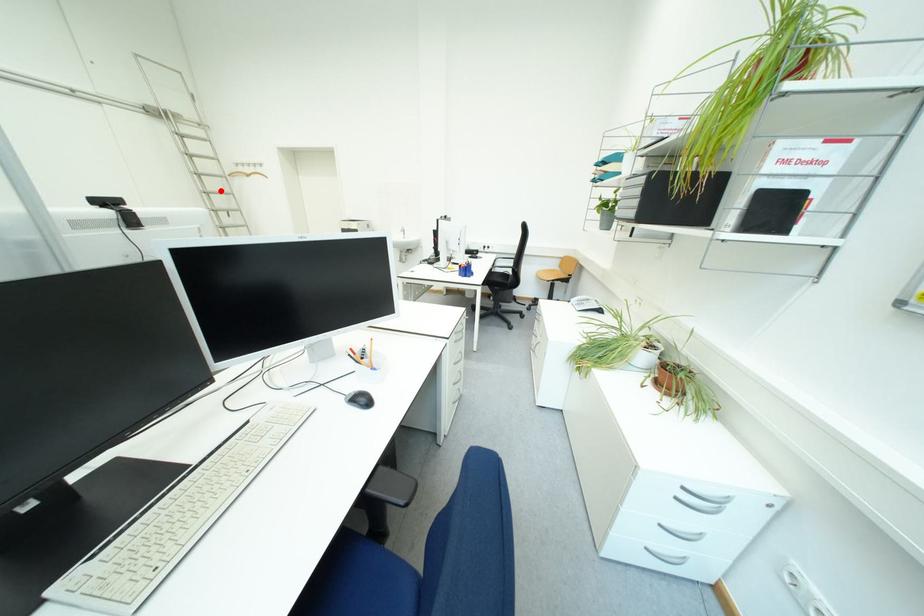
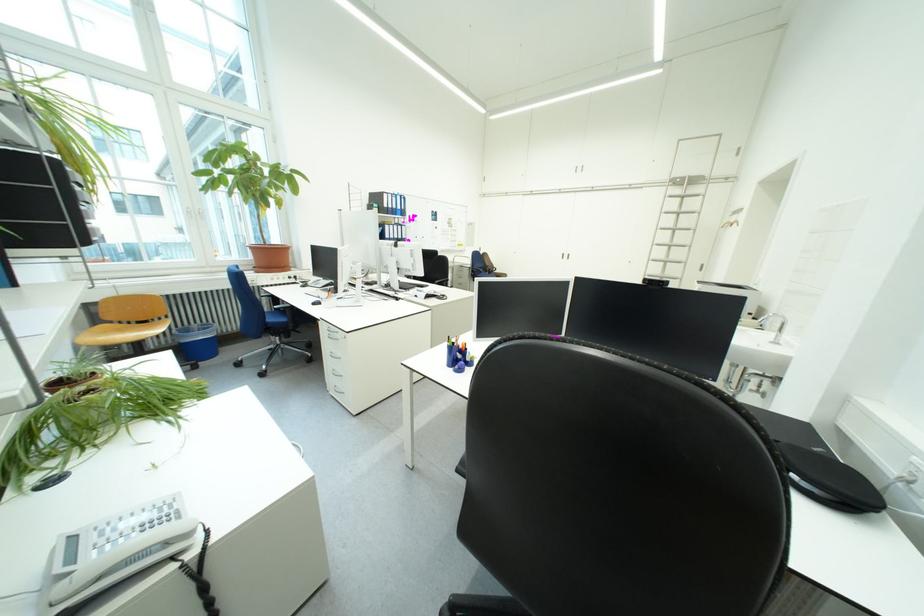
Question: I am providing you with two images of the same scene from different viewpoints. Given a red point in image1, look at the same physical point in image2. Is it:

Choices:
 (A) Closer to the viewpoint
 (B) Farther from the viewpoint

Answer: (A)